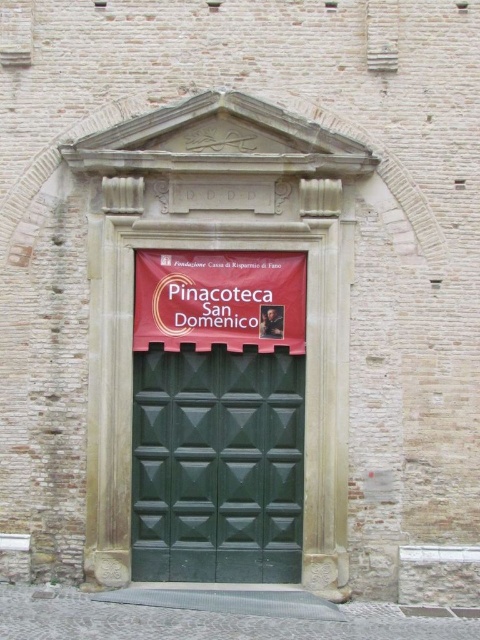
Does green textured door at center have a lesser height compared to red fabric banner at center?

In fact, green textured door at center may be taller than red fabric banner at center.

Between point (242, 483) and point (267, 264), which one is positioned behind?

Positioned behind is point (242, 483).

The width and height of the screenshot is (480, 640). Identify the location of green textured door at center. (216, 465).